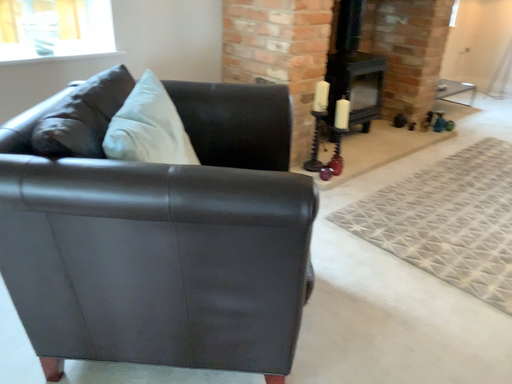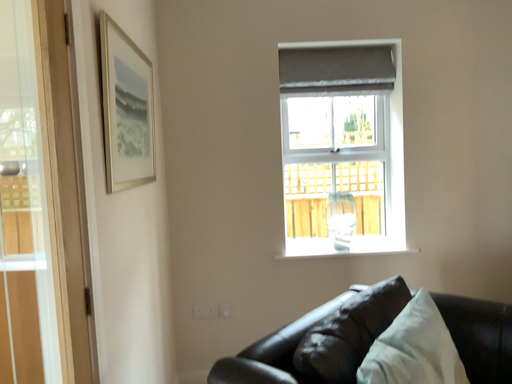
Question: How did the camera likely rotate when shooting the video?

Choices:
 (A) rotated right
 (B) rotated left

Answer: (B)